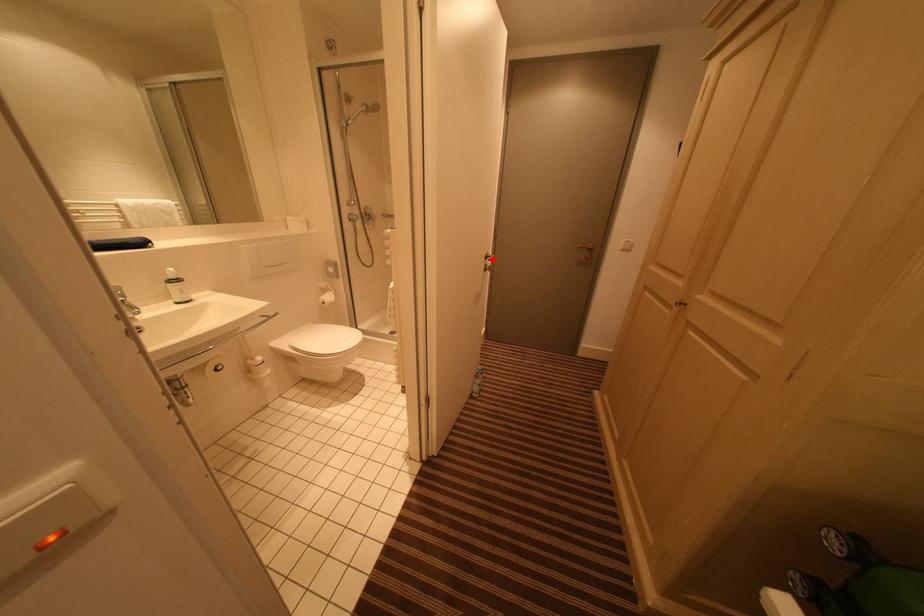
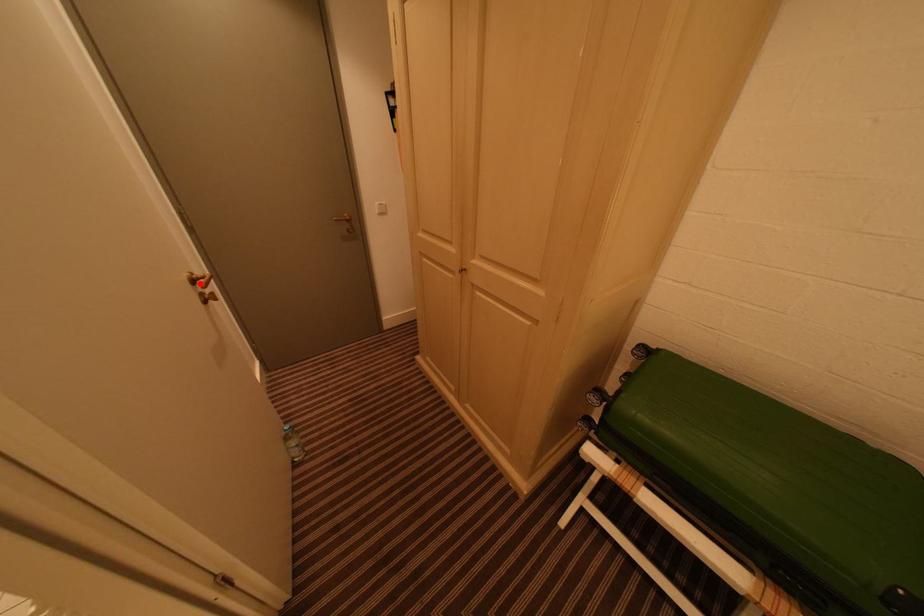
I am providing you with two images of the same scene from different viewpoints. A red point is marked on the first image and another point is marked on the second image. Does the point marked in image1 correspond to the same location as the one in image2?

Yes